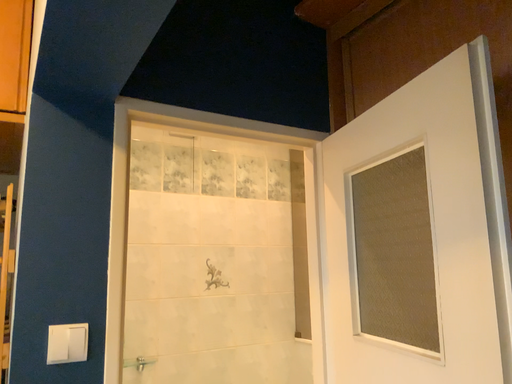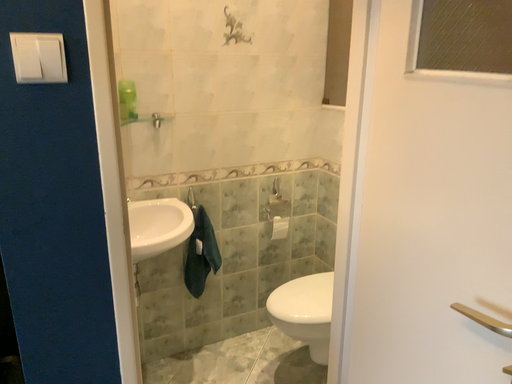
Question: How did the camera likely rotate when shooting the video?

Choices:
 (A) rotated upward
 (B) rotated downward

Answer: (B)